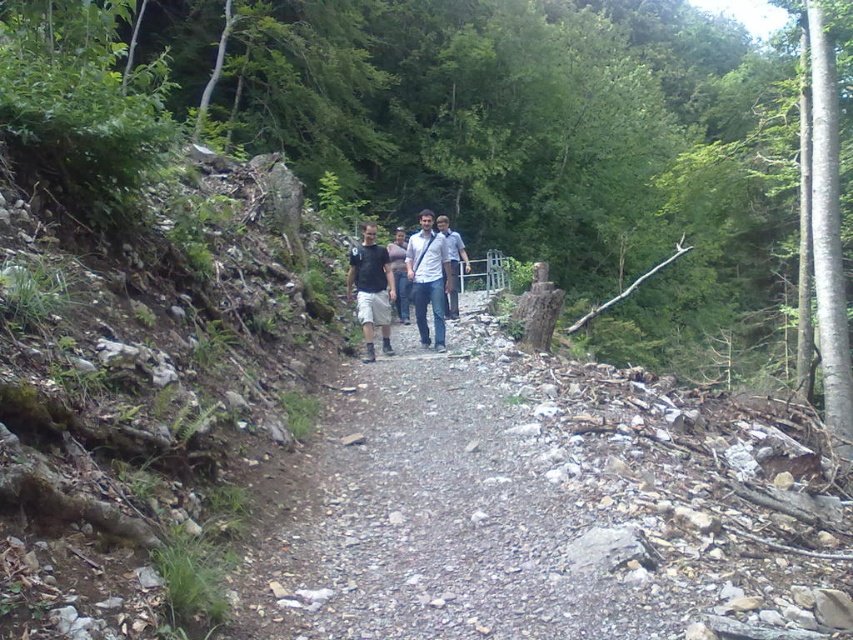
Which of these two, dark gray fabric shirt at center or white matte shirt at center, stands taller?

Standing taller between the two is dark gray fabric shirt at center.

Is dark gray fabric shirt at center below white matte shirt at center?

Correct, dark gray fabric shirt at center is located below white matte shirt at center.

This screenshot has height=640, width=853. In order to click on dark gray fabric shirt at center in this screenshot , I will do `click(428, 276)`.

Is dark gray fabric shirt at center below matte black t-shirt at center?

Actually, dark gray fabric shirt at center is above matte black t-shirt at center.

Can you confirm if dark gray fabric shirt at center is positioned to the left of matte black t-shirt at center?

No, dark gray fabric shirt at center is not to the left of matte black t-shirt at center.

At what (x,y) coordinates should I click in order to perform the action: click on dark gray fabric shirt at center. Please return your answer as a coordinate pair (x, y). This screenshot has width=853, height=640. Looking at the image, I should click on pos(428,276).

Is matte black t-shirt at center smaller than white matte shirt at center?

No.

Who is shorter, matte black t-shirt at center or white matte shirt at center?

matte black t-shirt at center is shorter.

The height and width of the screenshot is (640, 853). In order to click on matte black t-shirt at center in this screenshot , I will do `click(370, 289)`.